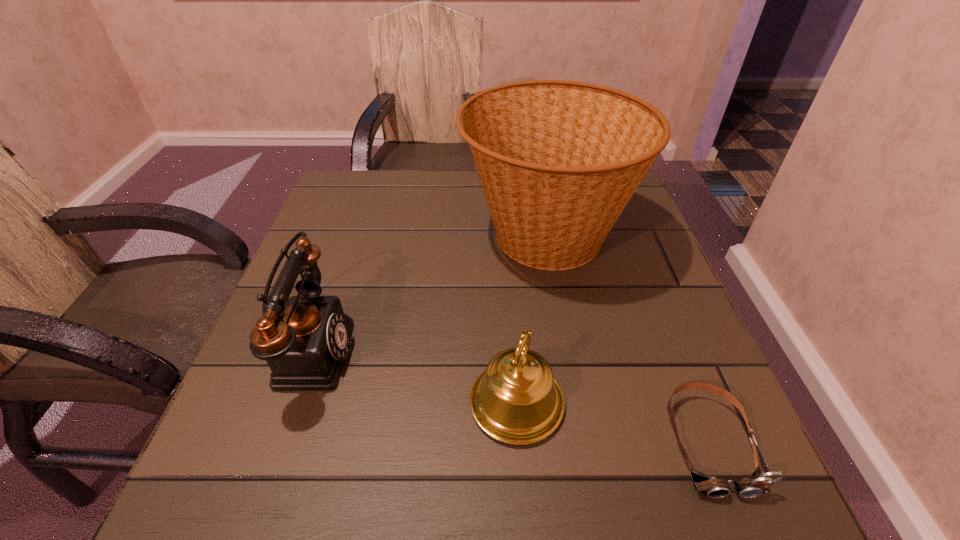
Select which object is the third closest to the bell. Please provide its 2D coordinates. Your answer should be formatted as a tuple, i.e. [(x, y)], where the tuple contains the x and y coordinates of a point satisfying the conditions above.

[(305, 347)]

Where is `blank area in the image that satisfies the following two spatial constraints: 1. on the front of the telephone at the rotary dial; 2. on the right side of the second shortest object`? blank area in the image that satisfies the following two spatial constraints: 1. on the front of the telephone at the rotary dial; 2. on the right side of the second shortest object is located at coordinates (290, 403).

At what (x,y) coordinates should I click in order to perform the action: click on vacant point that satisfies the following two spatial constraints: 1. on the front of the bell at the rotary dial; 2. on the right side of the leftmost object. Please return your answer as a coordinate pair (x, y). The width and height of the screenshot is (960, 540). Looking at the image, I should click on (290, 403).

Where is `free space that satisfies the following two spatial constraints: 1. on the back side of the bell; 2. on the front of the leftmost object at the rotary dial`? free space that satisfies the following two spatial constraints: 1. on the back side of the bell; 2. on the front of the leftmost object at the rotary dial is located at coordinates (513, 350).

Find the location of a particular element. This screenshot has height=540, width=960. vacant space that satisfies the following two spatial constraints: 1. on the front side of the farthest object; 2. on the front of the telephone at the rotary dial is located at coordinates (566, 350).